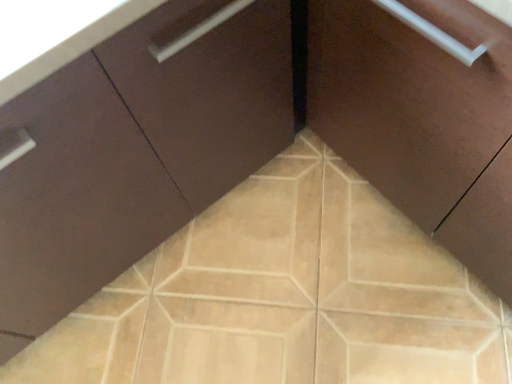
Question: Considering the relative sizes of matte brown cabinet at center, arranged as the 1th cabinetry when viewed from the right, and matte brown cabinet at center, the 2th cabinetry viewed from the right, in the image provided, is matte brown cabinet at center, arranged as the 1th cabinetry when viewed from the right, bigger than matte brown cabinet at center, the 2th cabinetry viewed from the right,?

Choices:
 (A) no
 (B) yes

Answer: (A)

Question: Considering the relative sizes of matte brown cabinet at center, which is the second cabinetry from left to right, and matte brown cabinet at center, the 2th cabinetry viewed from the right, in the image provided, is matte brown cabinet at center, which is the second cabinetry from left to right, shorter than matte brown cabinet at center, the 2th cabinetry viewed from the right,?

Choices:
 (A) no
 (B) yes

Answer: (B)

Question: From a real-world perspective, is matte brown cabinet at center, arranged as the 1th cabinetry when viewed from the right, located higher than matte brown cabinet at center, which appears as the 1th cabinetry when viewed from the left?

Choices:
 (A) no
 (B) yes

Answer: (A)

Question: Is the position of matte brown cabinet at center, which is the second cabinetry from left to right, less distant than that of matte brown cabinet at center, which appears as the 1th cabinetry when viewed from the left?

Choices:
 (A) yes
 (B) no

Answer: (B)

Question: Does matte brown cabinet at center, arranged as the 1th cabinetry when viewed from the right, have a smaller size compared to matte brown cabinet at center, which appears as the 1th cabinetry when viewed from the left?

Choices:
 (A) no
 (B) yes

Answer: (B)

Question: From the image's perspective, is beige ceramic tile at center located above or below matte brown cabinet at center, the 2th cabinetry viewed from the right?

Choices:
 (A) below
 (B) above

Answer: (A)

Question: Considering the positions of beige ceramic tile at center and matte brown cabinet at center, the 2th cabinetry viewed from the right, in the image, is beige ceramic tile at center taller or shorter than matte brown cabinet at center, the 2th cabinetry viewed from the right,?

Choices:
 (A) short
 (B) tall

Answer: (A)

Question: In the image, is beige ceramic tile at center on the left side or the right side of matte brown cabinet at center, which appears as the 1th cabinetry when viewed from the left?

Choices:
 (A) right
 (B) left

Answer: (A)

Question: Looking at their shapes, would you say beige ceramic tile at center is wider or thinner than matte brown cabinet at center, the 2th cabinetry viewed from the right?

Choices:
 (A) wide
 (B) thin

Answer: (A)

Question: From the image's perspective, is matte brown cabinet at center, the 2th cabinetry viewed from the right, located above or below matte brown cabinet at center, which is the second cabinetry from left to right?

Choices:
 (A) above
 (B) below

Answer: (B)

Question: Is matte brown cabinet at center, which appears as the 1th cabinetry when viewed from the left, wider or thinner than matte brown cabinet at center, arranged as the 1th cabinetry when viewed from the right?

Choices:
 (A) wide
 (B) thin

Answer: (A)

Question: Does point (117, 226) appear closer or farther from the camera than point (365, 170)?

Choices:
 (A) farther
 (B) closer

Answer: (B)

Question: From a real-world perspective, is matte brown cabinet at center, the 2th cabinetry viewed from the right, above or below matte brown cabinet at center, arranged as the 1th cabinetry when viewed from the right?

Choices:
 (A) above
 (B) below

Answer: (A)

Question: In the image, is matte brown cabinet at center, arranged as the 1th cabinetry when viewed from the right, positioned in front of or behind beige ceramic tile at center?

Choices:
 (A) front
 (B) behind

Answer: (A)

Question: From the image's perspective, is matte brown cabinet at center, arranged as the 1th cabinetry when viewed from the right, above or below beige ceramic tile at center?

Choices:
 (A) below
 (B) above

Answer: (B)